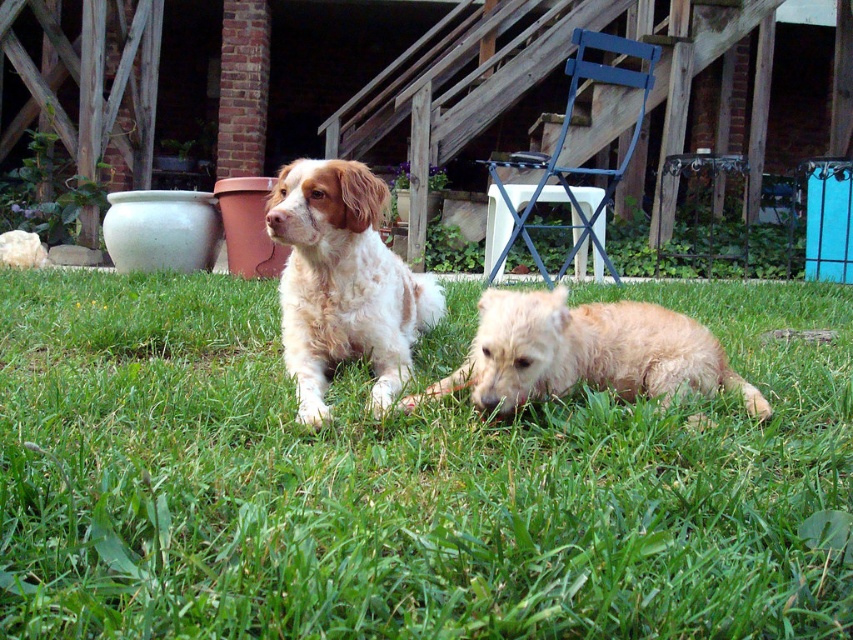
Who is more distant from viewer, (312, 188) or (614, 342)?

The point (312, 188) is behind.

The width and height of the screenshot is (853, 640). What do you see at coordinates (343, 284) in the screenshot?
I see `light brown fur dog at center` at bounding box center [343, 284].

Locate an element on the screen. light brown fur dog at center is located at coordinates (343, 284).

Can you confirm if green grass at center is wider than light brown fur dog at center?

Correct, the width of green grass at center exceeds that of light brown fur dog at center.

From the picture: Who is higher up, green grass at center or light brown fur dog at center?

light brown fur dog at center is higher up.

Where is `green grass at center`? The image size is (853, 640). green grass at center is located at coordinates (405, 481).

Does green grass at center have a greater width compared to fuzzy golden dog at lower center?

Yes.

Locate an element on the screen. green grass at center is located at coordinates (405, 481).